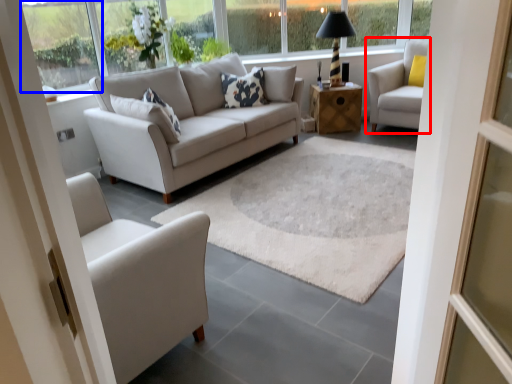
Question: Which of the following is the closest to the observer, chair (highlighted by a red box) or window (highlighted by a blue box)?

Choices:
 (A) chair
 (B) window

Answer: (B)